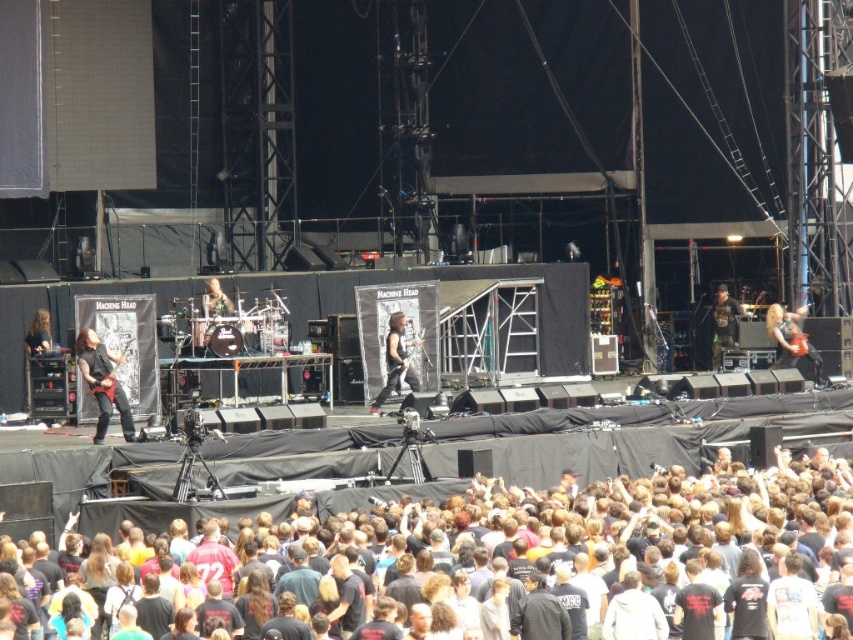
You are standing at the point marked as point (636,547). What is the nearest object to you in the scene?

The nearest object to you at point (636,547) is the black cotton crowd at lower center since the point is located on it.

You are a photographer at the Machine Head concert. You want to capture a photo that includes both the black cotton crowd at lower center and the shiny black guitar at left. Which object should you focus on first to ensure it appears larger in the photo?

The black cotton crowd at lower center has a greater height compared to the shiny black guitar at left, so you should focus on the black cotton crowd at lower center first to ensure it appears larger in the photo.

You are a photographer at the Machine Head concert. You want to capture a photo that includes both the shiny red guitar at right and the matte black guitar at center. From the audience perspective, which guitar appears lower in the photo?

The shiny red guitar at right appears lower in the photo because it is positioned below the matte black guitar at center.